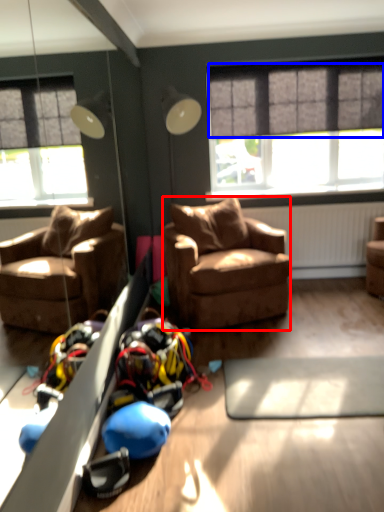
Question: Which object is further to the camera taking this photo, studio couch (highlighted by a red box) or curtain (highlighted by a blue box)?

Choices:
 (A) studio couch
 (B) curtain

Answer: (B)